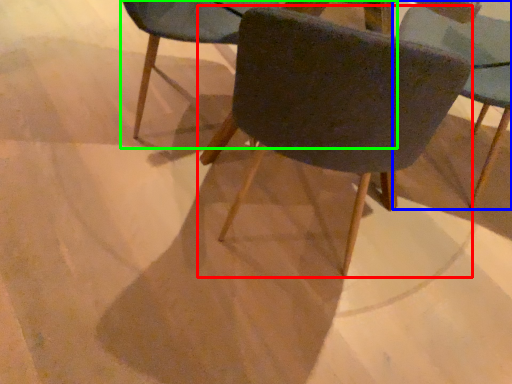
Question: Which object is the farthest from chair (highlighted by a red box)? Choose among these: chair (highlighted by a blue box) or chair (highlighted by a green box).

Choices:
 (A) chair
 (B) chair

Answer: (A)